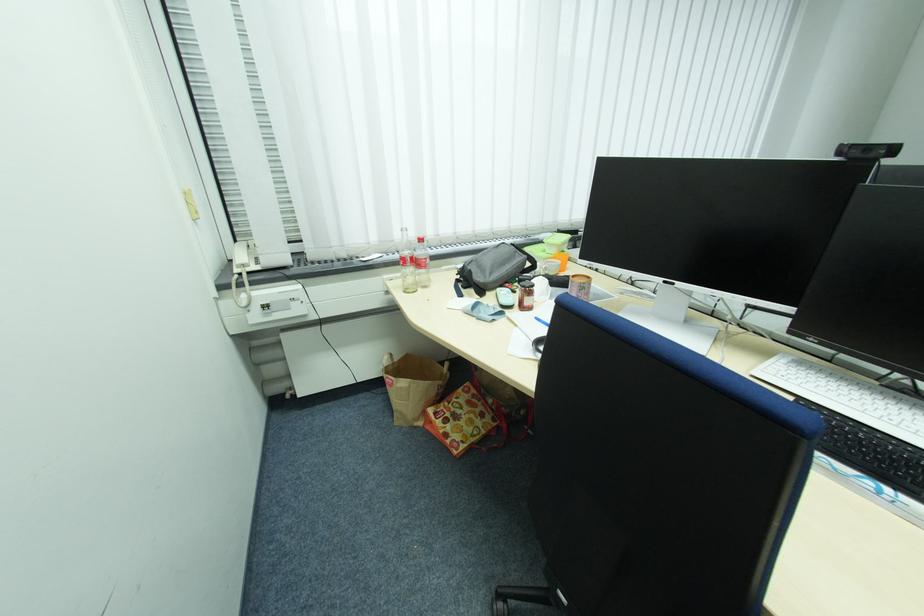
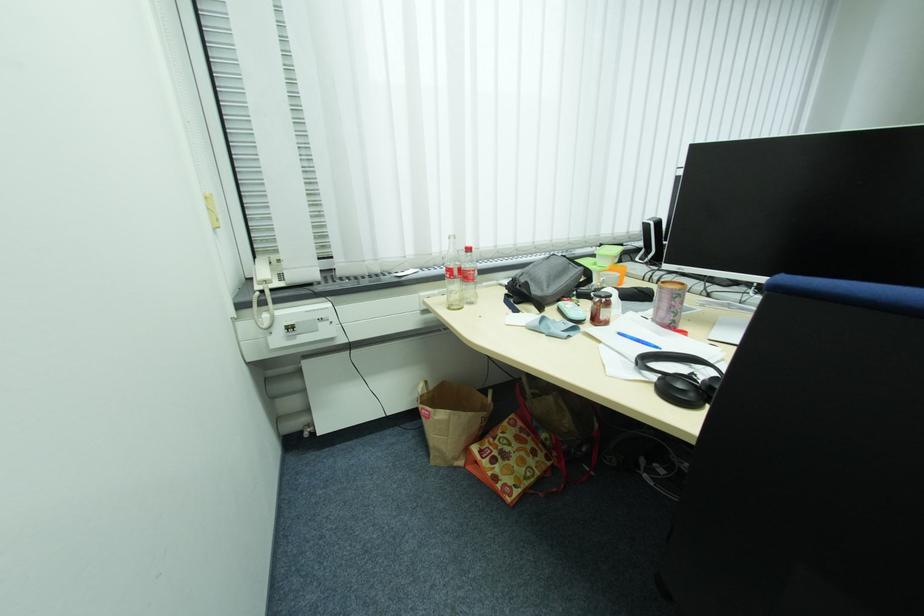
Where in the second image is the point corresponding to (411,292) from the first image?

(456, 309)